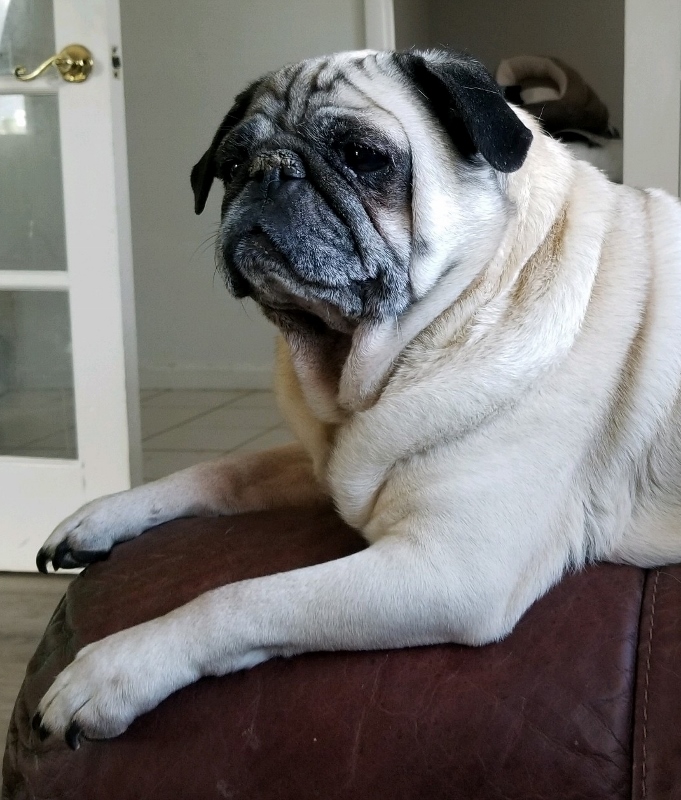
This screenshot has width=681, height=800. Find the location of `handle`. handle is located at coordinates (50, 57).